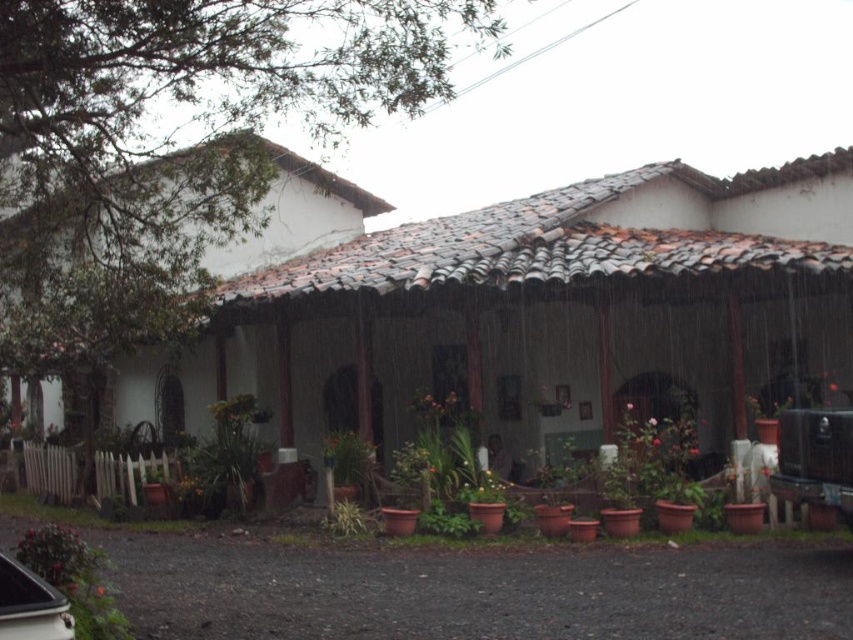
Question: Which object is positioned closest to the green leafy plant at center?

Choices:
 (A) green leafy plant at lower center
 (B) metallic silver car at lower left
 (C) green matte plant at lower left
 (D) green leafy plant at lower left

Answer: (A)

Question: Estimate the real-world distances between objects in this image. Which object is farther from the green leafy plant at lower left?

Choices:
 (A) green leafy plant at center
 (B) metallic silver car at lower left
 (C) green leafy plant at lower center
 (D) green matte plant at lower left

Answer: (B)

Question: In this image, where is green matte plant at lower left located relative to metallic silver car at lower left?

Choices:
 (A) above
 (B) below

Answer: (B)

Question: Which is farther from the metallic silver car at lower left?

Choices:
 (A) green matte plant at lower left
 (B) green leafy plant at lower left
 (C) green leafy plant at lower center
 (D) green leafy plant at center

Answer: (B)

Question: Can you confirm if green leafy plant at lower left is thinner than green matte plant at lower left?

Choices:
 (A) no
 (B) yes

Answer: (A)

Question: Is metallic silver car at lower left wider than green leafy plant at center?

Choices:
 (A) yes
 (B) no

Answer: (B)